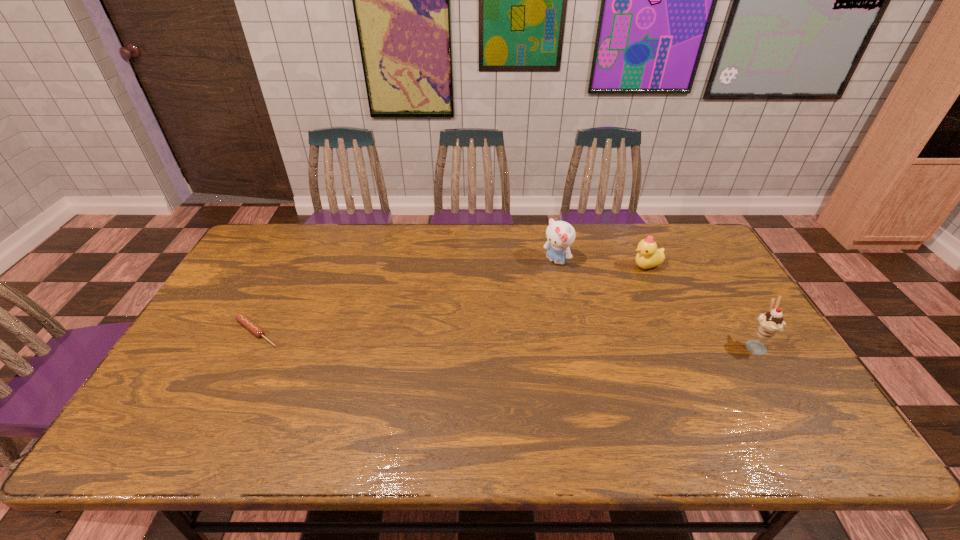
You are a GUI agent. You are given a task and a screenshot of the screen. Output one action in this format:
    pyautogui.click(x=<x>, y=<y>)
    Task: Click on the vacant space on the desktop that is between the leftmost object and the icecream and is positioned on the front-facing side of the kitten
    This screenshot has height=540, width=960.
    Given the screenshot: What is the action you would take?
    pyautogui.click(x=469, y=338)

Where is `free spot on the desktop that is between the shortest object and the icecream and is positioned on the front-facing side of the duckling`? The width and height of the screenshot is (960, 540). free spot on the desktop that is between the shortest object and the icecream and is positioned on the front-facing side of the duckling is located at coordinates (542, 340).